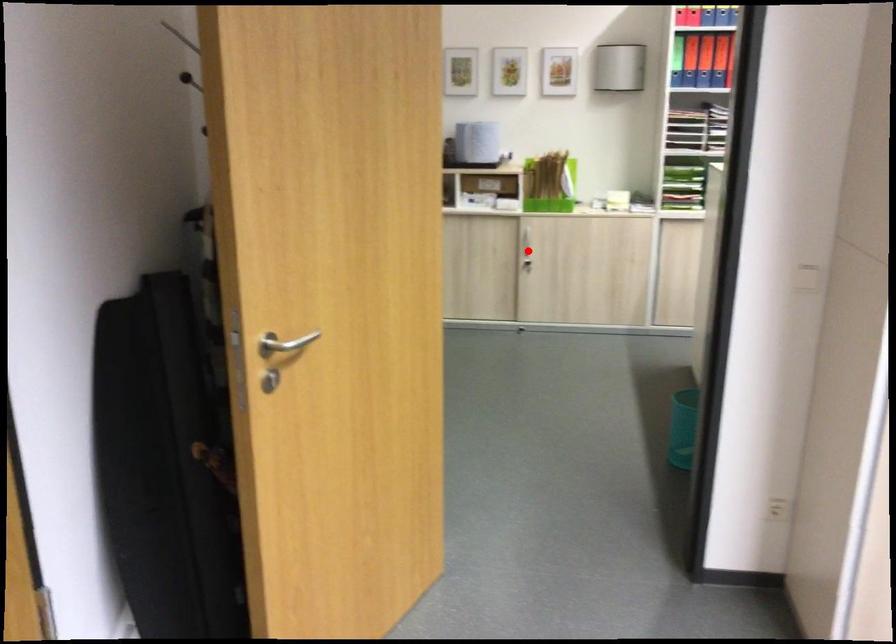
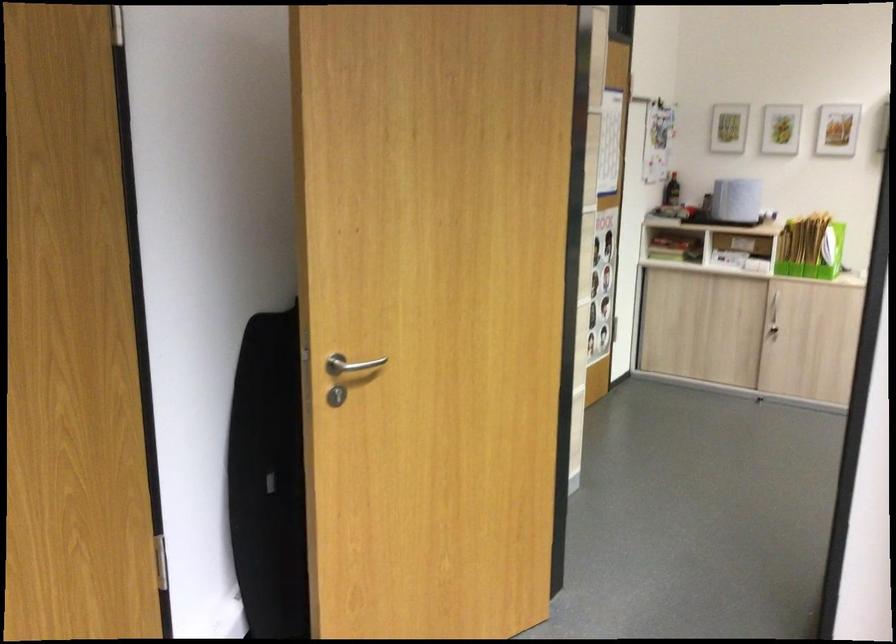
The point at the highlighted location is marked in the first image. Where is the corresponding point in the second image?

(771, 317)